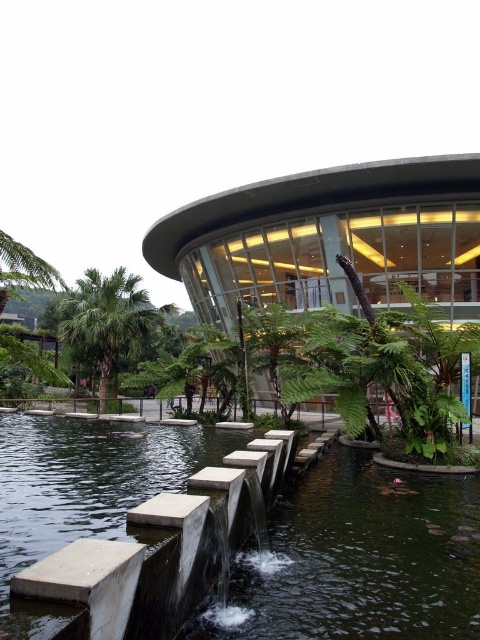
This screenshot has width=480, height=640. I want to click on smooth concrete pond at center, so click(x=359, y=560).

Between smooth concrete pond at center and green leafy palm tree at center, which one is positioned higher?

Positioned higher is green leafy palm tree at center.

Does point (319, 525) come behind point (284, 316)?

No, it is not.

The width and height of the screenshot is (480, 640). I want to click on smooth concrete pond at center, so click(x=359, y=560).

Is point (110, 296) closer to viewer compared to point (253, 344)?

No, (110, 296) is behind (253, 344).

Is green leafy palm tree at left to the left of green leafy palm tree at center from the viewer's perspective?

Yes, green leafy palm tree at left is to the left of green leafy palm tree at center.

Between point (115, 275) and point (248, 397), which one is positioned behind?

The point (115, 275) is behind.

Locate an element on the screen. green leafy palm tree at left is located at coordinates (108, 320).

Based on the photo, can you confirm if smooth concrete pond at center is positioned to the left of green leafy palm tree at left?

Incorrect, smooth concrete pond at center is not on the left side of green leafy palm tree at left.

The width and height of the screenshot is (480, 640). What are the coordinates of `smooth concrete pond at center` in the screenshot? It's located at (359, 560).